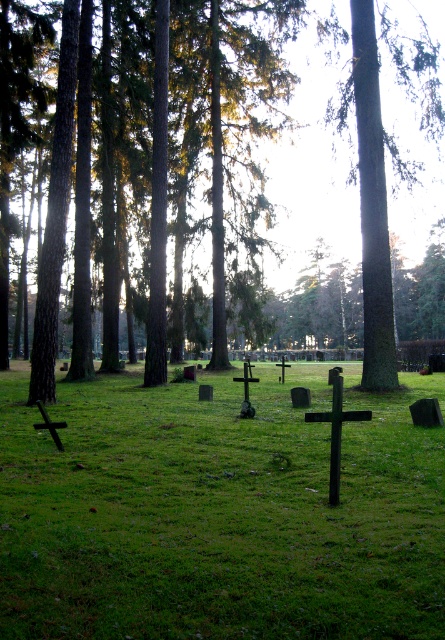
You are a gardener planning to plant a new tree in the cemetery. You notice the brown wood tree at center and the green rough bark tree at center. Which tree should you avoid planting if you want to prevent overshadowing the graves with its large size?

The brown wood tree at center has a larger size compared to the green rough bark tree at center, so you should avoid planting the brown wood tree at center to prevent overshadowing the graves.

You are a gardener planning to plant a new tree in the cemetery. The brown wood tree at center and the green rough bark tree at center are already present. Which tree has a wider trunk that might require more space in the garden?

The brown wood tree at center has a larger width than the green rough bark tree at center, so it requires more space in the garden.

You are a gardener who needs to place a 2 meter wide decorative stone between the green grassy at center and the green rough bark tree at center. Is there enough space between them to place the stone without moving either object?

The distance between the green grassy at center and the green rough bark tree at center is 7.76 meters. Since the decorative stone is only 2 meters wide, there is sufficient space to place it between them without needing to move either object.